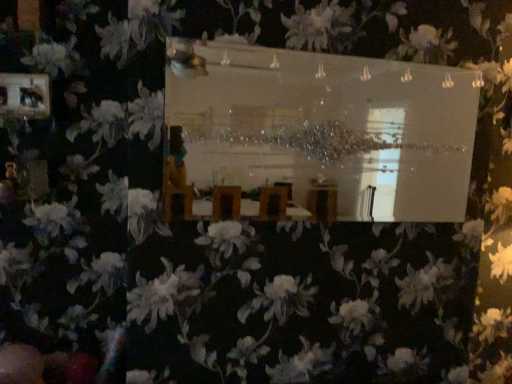
Question: Is clear glass mirror at center bigger or smaller than matte black picture frame at upper left?

Choices:
 (A) big
 (B) small

Answer: (A)

Question: Would you say clear glass mirror at center is to the left or to the right of matte black picture frame at upper left in the picture?

Choices:
 (A) left
 (B) right

Answer: (B)

Question: Is clear glass mirror at center inside the boundaries of matte black picture frame at upper left, or outside?

Choices:
 (A) outside
 (B) inside

Answer: (A)

Question: Is matte black picture frame at upper left wider or thinner than clear glass mirror at center?

Choices:
 (A) thin
 (B) wide

Answer: (A)

Question: From the image's perspective, relative to clear glass mirror at center, is matte black picture frame at upper left above or below?

Choices:
 (A) above
 (B) below

Answer: (A)

Question: Based on their sizes in the image, would you say matte black picture frame at upper left is bigger or smaller than clear glass mirror at center?

Choices:
 (A) big
 (B) small

Answer: (B)

Question: From a real-world perspective, is matte black picture frame at upper left physically located above or below clear glass mirror at center?

Choices:
 (A) above
 (B) below

Answer: (A)